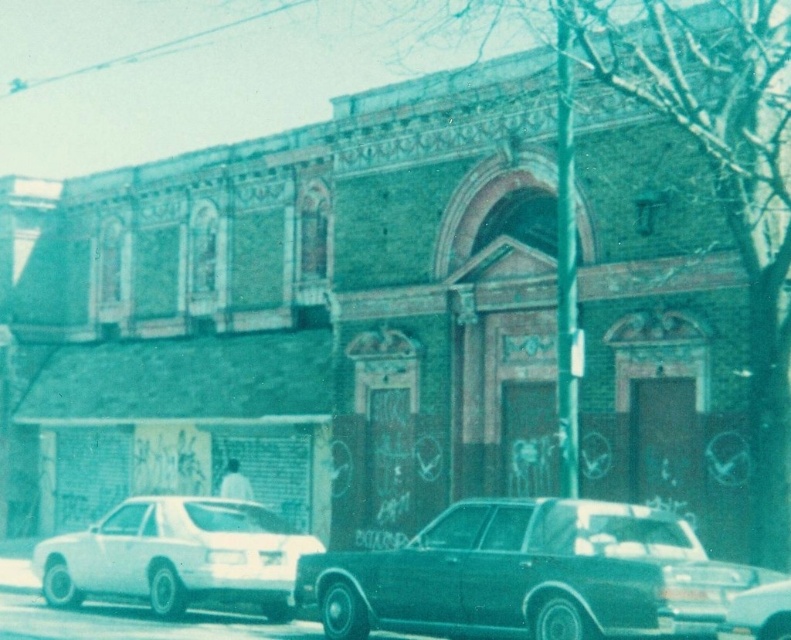
Does white glossy sedan at lower left appear under metallic silver sedan at center?

Yes, white glossy sedan at lower left is below metallic silver sedan at center.

Between white glossy sedan at lower left and metallic silver sedan at center, which one has more height?

With more height is white glossy sedan at lower left.

Which is in front, point (46, 589) or point (763, 616)?

Point (763, 616) is in front.

You are a GUI agent. You are given a task and a screenshot of the screen. Output one action in this format:
    pyautogui.click(x=<x>, y=<y>)
    Task: Click on the white glossy sedan at lower left
    This screenshot has width=791, height=640.
    Given the screenshot: What is the action you would take?
    pyautogui.click(x=176, y=556)

Describe the element at coordinates (528, 576) in the screenshot. The height and width of the screenshot is (640, 791). I see `shiny black sedan at center` at that location.

Which is more to the left, shiny black sedan at center or white glossy sedan at lower left?

Positioned to the left is white glossy sedan at lower left.

Where is `shiny black sedan at center`? The height and width of the screenshot is (640, 791). shiny black sedan at center is located at coordinates (528, 576).

Does point (491, 572) come in front of point (737, 627)?

That is False.

Can you confirm if shiny black sedan at center is smaller than metallic silver sedan at center?

Correct, shiny black sedan at center occupies less space than metallic silver sedan at center.

Does point (725, 596) come behind point (767, 620)?

Yes, it is.

Where is `shiny black sedan at center`? Image resolution: width=791 pixels, height=640 pixels. shiny black sedan at center is located at coordinates (x=528, y=576).